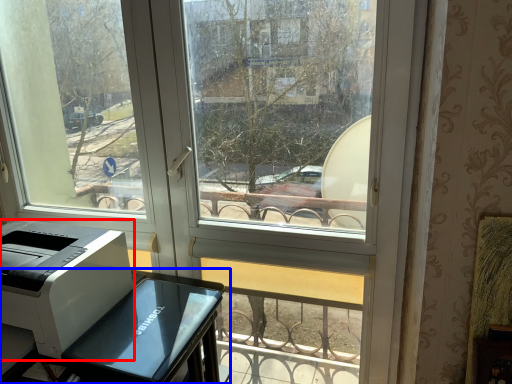
Question: Which of the following is the farthest to the observer, printer (highlighted by a red box) or furniture (highlighted by a blue box)?

Choices:
 (A) printer
 (B) furniture

Answer: (A)